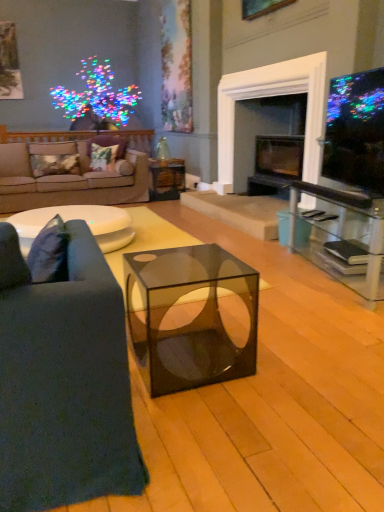
Locate an element on the screen. The height and width of the screenshot is (512, 384). vacant area that lies to the right of transparent glass cube at center is located at coordinates (287, 360).